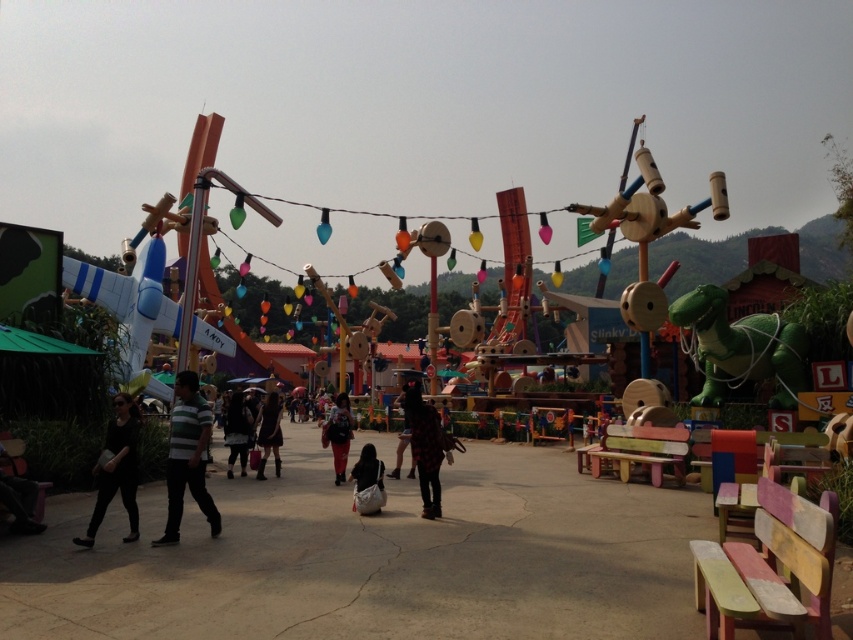
What are the coordinates of the green rubber dinosaur at right in the image?

The coordinates of the green rubber dinosaur at right are at point (740, 348).

You are standing in the theme park and see a black checkered shirt at center. Can you tell me what is located at point [426,449]?

The black checkered shirt at center is located at point [426,449].

You are standing at the entrance of the theme park and want to find the black matte pants at lower left. According to the map coordinates, where should you look?

The black matte pants at lower left are located at coordinates point (115, 468).